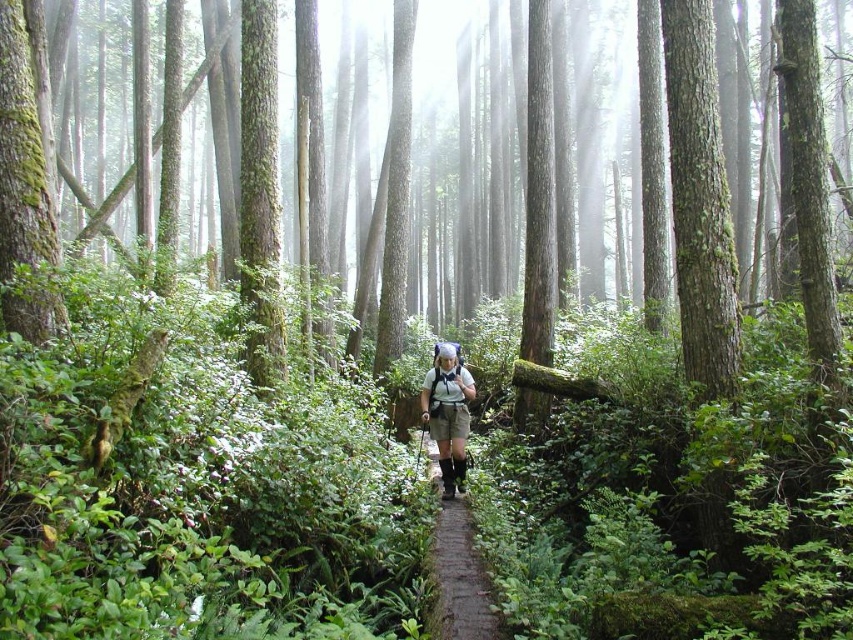
You are a hiker standing in the forest and see the brown dirt path at center and the khaki fabric shorts at center. Which object is positioned to the right of the other?

The brown dirt path at center is to the right of khaki fabric shorts at center.

You are standing on the brown dirt path at center and see the khaki fabric shorts at center nearby. Which object is taller?

The khaki fabric shorts at center are taller than the brown dirt path at center.

You are standing in the middle of a misty forest and see a brown dirt path at center and khaki fabric shorts at center. Which object is closer to you?

The brown dirt path at center is 8.09 feet away from khaki fabric shorts at center, so the khaki fabric shorts at center is closer to you since it is positioned at the center while the path is slightly further away.